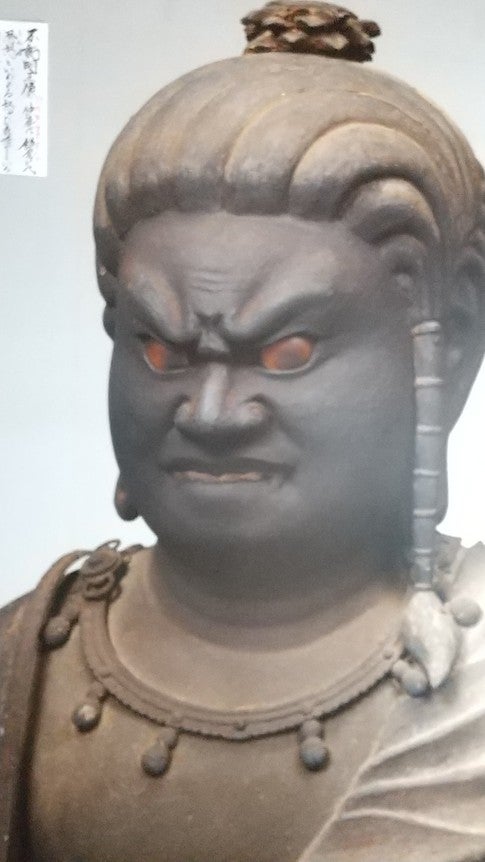
At what (x,y) coordinates should I click in order to perform the action: click on statue. Please return your answer as a coordinate pair (x, y). Looking at the image, I should click on (208, 650).